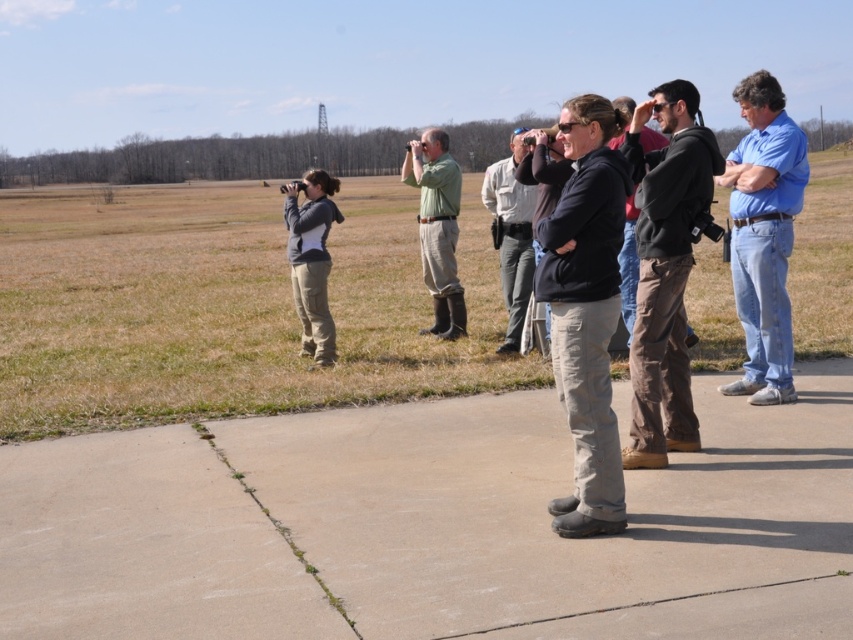
You are a photographer planning to capture a wide shot of the group standing on the concrete pavement at center and the blue denim jeans at right. Considering the spatial arrangement, which object takes up more area in the image?

The blue denim jeans at right occupies more space in the image than the concrete pavement at center, as the concrete pavement at center occupies less space than blue denim jeans at right according to the description.

You are a photographer trying to capture a group photo of the dark brown leather pants at center and the dark gray hoodie at center. The minimum focusing distance for your camera is 24 inches. Can you take the photo without moving either subject?

The dark brown leather pants at center is 24.45 inches from dark gray hoodie at center. Since the distance is slightly over 24 inches, the camera can focus and take the photo without moving either subject.

You are planning to place a 2 meter wide tent on the concrete pavement at center. Can the blue denim jeans at right be placed on the same pavement without overlapping?

The concrete pavement at center is wider than the blue denim jeans at right, so yes, the blue denim jeans at right can be placed on the same pavement without overlapping.